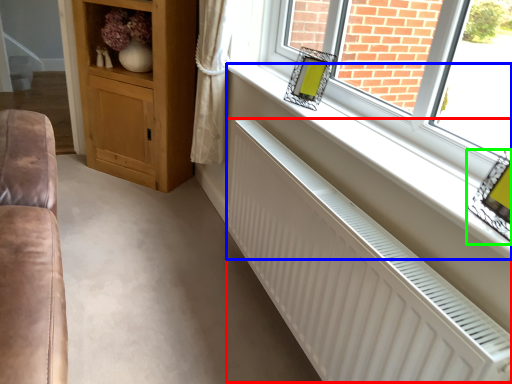
Question: Based on their relative distances, which object is farther from radiator (highlighted by a red box)? Choose from window sill (highlighted by a blue box) and picture frame (highlighted by a green box).

Choices:
 (A) window sill
 (B) picture frame

Answer: (B)